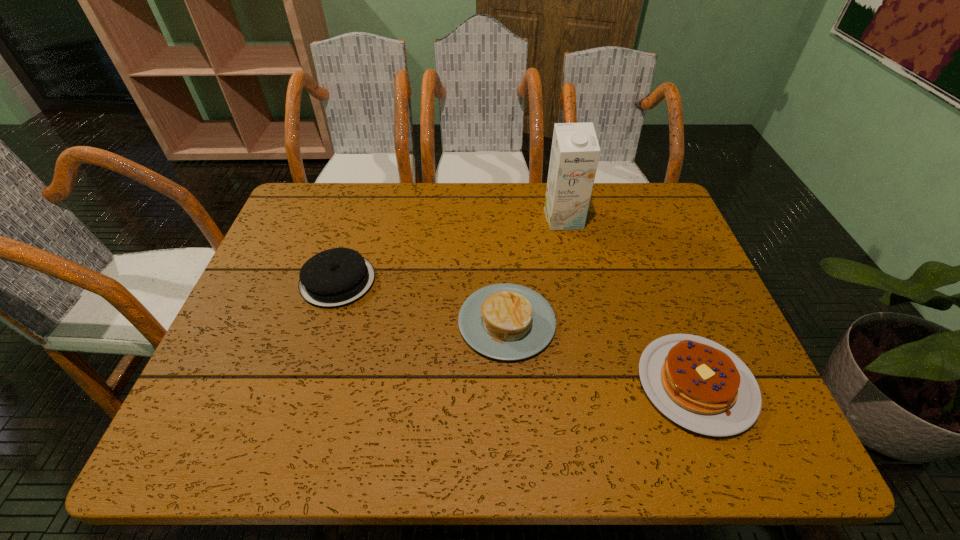
The width and height of the screenshot is (960, 540). Find the location of `free area in between the tallest object and the rightmost pancake`. free area in between the tallest object and the rightmost pancake is located at coordinates (630, 301).

Locate an element on the screen. free spot between the rightmost object and the tallest object is located at coordinates (630, 301).

Locate an element on the screen. Image resolution: width=960 pixels, height=540 pixels. vacant area between the second object from left to right and the rightmost pancake is located at coordinates (602, 353).

This screenshot has height=540, width=960. What are the coordinates of `free spot between the leftmost object and the farthest object` in the screenshot? It's located at (450, 250).

At what (x,y) coordinates should I click in order to perform the action: click on vacant space in between the leftmost object and the carton. Please return your answer as a coordinate pair (x, y). This screenshot has height=540, width=960. Looking at the image, I should click on (450, 250).

The image size is (960, 540). What are the coordinates of `free area in between the third object from right to left and the third object from left to right` in the screenshot? It's located at click(x=535, y=271).

Identify the location of the closest object to the second object from left to right. The width and height of the screenshot is (960, 540). (699, 384).

Locate an element on the screen. This screenshot has height=540, width=960. object that stands as the third closest to the third object from right to left is located at coordinates (575, 151).

The image size is (960, 540). In order to click on the third closest pancake to the farthest object in this screenshot , I will do `click(336, 277)`.

Find the location of a particular element. pancake that stands as the second closest to the second object from right to left is located at coordinates (699, 384).